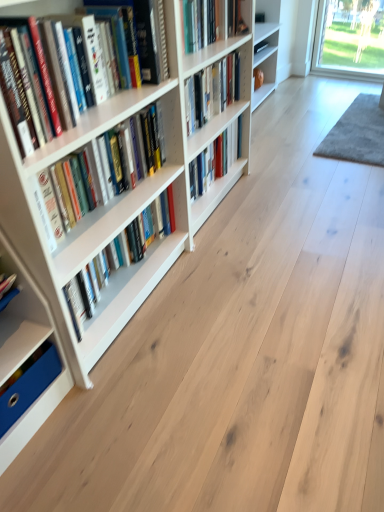
Question: Is hardcover book at center, acting as the fifth book starting from the bottom, inside the boundaries of white matte bookshelf at left, or outside?

Choices:
 (A) inside
 (B) outside

Answer: (B)

Question: Looking at their shapes, would you say hardcover book at center, acting as the fifth book starting from the bottom, is wider or thinner than white matte bookshelf at left?

Choices:
 (A) wide
 (B) thin

Answer: (B)

Question: Based on their relative distances, which object is farther from the hardcover book at center, acting as the fifth book starting from the bottom?

Choices:
 (A) white matte bookshelf at left
 (B) hardcover books at left, which is counted as the second book, starting from the bottom
 (C) hardcover book at center, which ranks as the third book in top-to-bottom order
 (D) hardcover books at left, the second book from the top
 (E) white matte bookcase at left

Answer: (A)

Question: Estimate the real-world distances between objects in this image. Which object is farther from the hardcover book at center, which is the 3th book from bottom to top?

Choices:
 (A) blue cardboard box at lower left, the fifth book when ordered from top to bottom
 (B) hardcover book at center, acting as the fifth book starting from the bottom
 (C) white matte bookshelf at left
 (D) hardcover books at left, which is counted as the second book, starting from the bottom
 (E) white matte bookcase at left

Answer: (A)